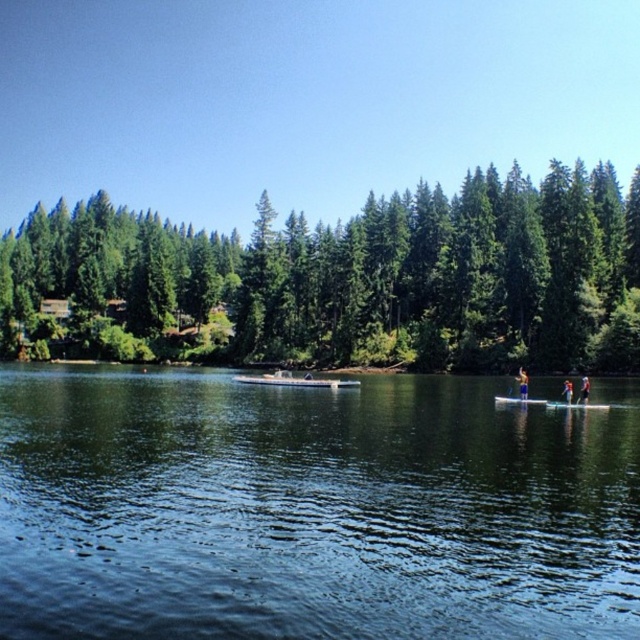
Question: Which point is farther to the camera?

Choices:
 (A) (284, 339)
 (B) (522, 401)

Answer: (A)

Question: Which object is closer to the camera taking this photo?

Choices:
 (A) blue fabric surfboard at center
 (B) white matte boat at center

Answer: (A)

Question: Which point appears farthest from the camera in this image?

Choices:
 (A) (566, 403)
 (B) (99, 570)

Answer: (A)

Question: Can you confirm if green matte trees at center is smaller than yellow fabric paddleboard at center?

Choices:
 (A) no
 (B) yes

Answer: (A)

Question: From the image, what is the correct spatial relationship of green matte trees at center in relation to blue fabric surfboard at center?

Choices:
 (A) above
 (B) below

Answer: (A)

Question: Where is dark blue water at center located in relation to white matte boat at center in the image?

Choices:
 (A) right
 (B) left

Answer: (B)